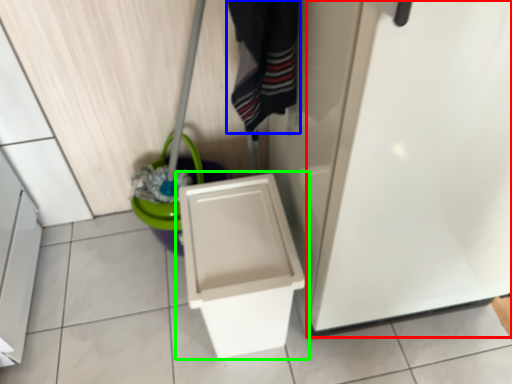
Question: Which object is positioned farthest from screen door (highlighted by a red box)? Select from clothing (highlighted by a blue box) and toilet (highlighted by a green box).

Choices:
 (A) clothing
 (B) toilet

Answer: (A)